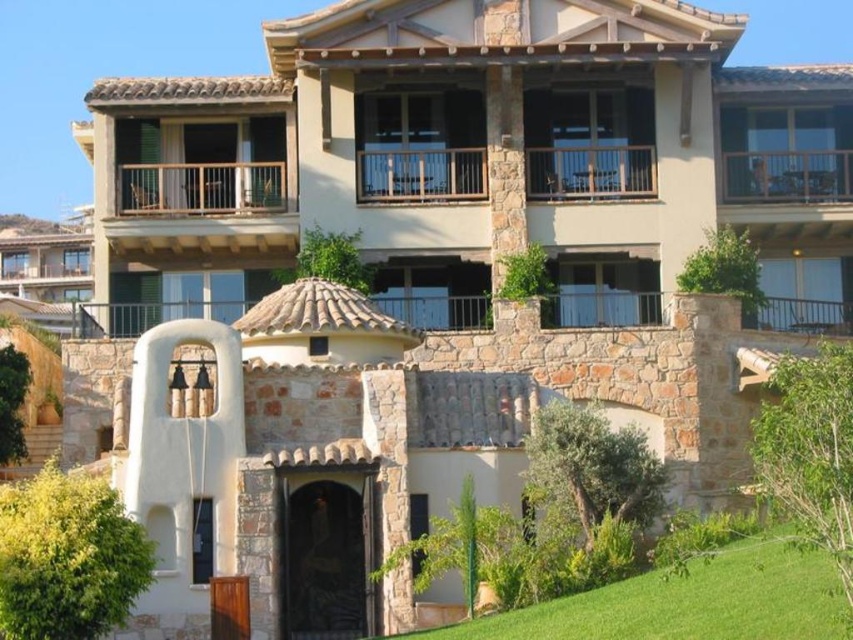
Question: Which point is closer to the camera?

Choices:
 (A) (602, 189)
 (B) (170, 202)
 (C) (677, 637)

Answer: (C)

Question: Which of the following is the closest to the observer?

Choices:
 (A) (819, 193)
 (B) (786, 566)
 (C) (625, 180)
 (D) (276, 198)

Answer: (B)

Question: Is wooden at upper center to the left of wooden railing at upper right from the viewer's perspective?

Choices:
 (A) no
 (B) yes

Answer: (B)

Question: Can you confirm if green grass at lower right is positioned above wooden at upper center?

Choices:
 (A) no
 (B) yes

Answer: (A)

Question: Does green grass at lower right appear on the left side of wooden railing at upper right?

Choices:
 (A) yes
 (B) no

Answer: (A)

Question: Which of these objects is positioned farthest from the wooden railing at upper right?

Choices:
 (A) brown wooden railing at upper center
 (B) green grass at lower right
 (C) wooden at upper center

Answer: (B)